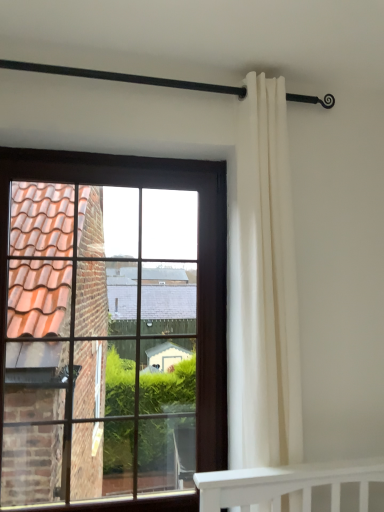
Question: From the image's perspective, relative to black metal rod at upper center, is brown wooden window at left above or below?

Choices:
 (A) below
 (B) above

Answer: (A)

Question: From a real-world perspective, relative to black metal rod at upper center, is brown wooden window at left vertically above or below?

Choices:
 (A) above
 (B) below

Answer: (B)

Question: Considering the real-world distances, which object is closest to the white fabric curtain at right?

Choices:
 (A) black metal rod at upper center
 (B) brown wooden window at left

Answer: (A)

Question: Which object is the farthest from the white fabric curtain at right?

Choices:
 (A) brown wooden window at left
 (B) black metal rod at upper center

Answer: (A)